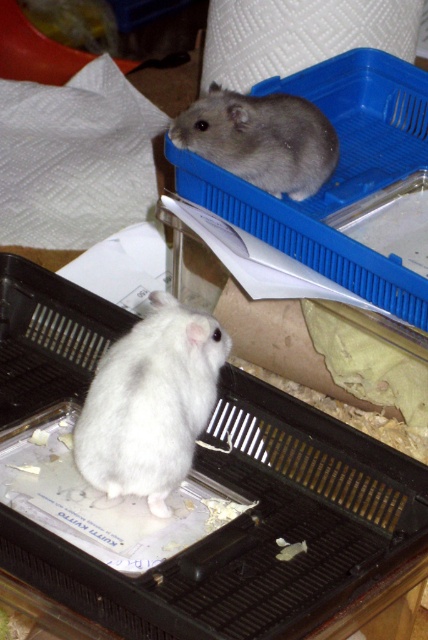
You are a small toy mouse trying to move from the white hamster in the black plastic cage to the gray hamster in the blue container. The coordinates of your starting point are point (x=142, y=433) and your destination is point (x=195, y=141). Since you can only move forward, will you be able to reach the gray hamster without turning around?

Point (x=142, y=433) is in front of point (x=195, y=141). Since you can only move forward, you will not be able to reach the gray hamster in the blue container without turning around because you are already ahead of the destination point.

You are a veterinarian examining two hamsters. The white fluffy hamster at center is in a black plastic cage, and the gray furry hamster at upper center is in a blue container. Which hamster is taller?

The white fluffy hamster at center is taller than the gray furry hamster at upper center according to the description.